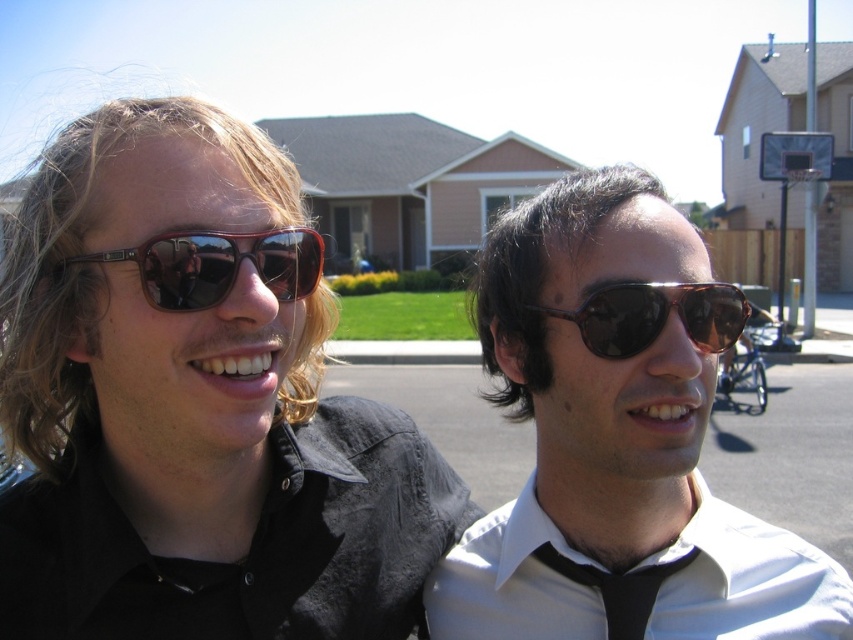
Does black shiny sunglasses at center appear on the left side of matte brown sunglasses at left?

Incorrect, black shiny sunglasses at center is not on the left side of matte brown sunglasses at left.

Can you confirm if black shiny sunglasses at center is bigger than matte brown sunglasses at left?

Yes.

Looking at this image, who is more forward, [753,609] or [166,259]?

Positioned in front is point [166,259].

In order to click on black shiny sunglasses at center in this screenshot , I will do `click(618, 440)`.

Does black shiny sunglasses at center have a greater height compared to white smooth shirt at center?

Yes.

Which is in front, point (664, 248) or point (495, 624)?

Point (664, 248) is in front.

Does point (560, 525) lie in front of point (820, 618)?

No, it is not.

In order to click on black shiny sunglasses at center in this screenshot , I will do `click(618, 440)`.

Who is shorter, white smooth shirt at center or shiny brown sunglasses at center?

shiny brown sunglasses at center

Where is `white smooth shirt at center`? white smooth shirt at center is located at coordinates (637, 580).